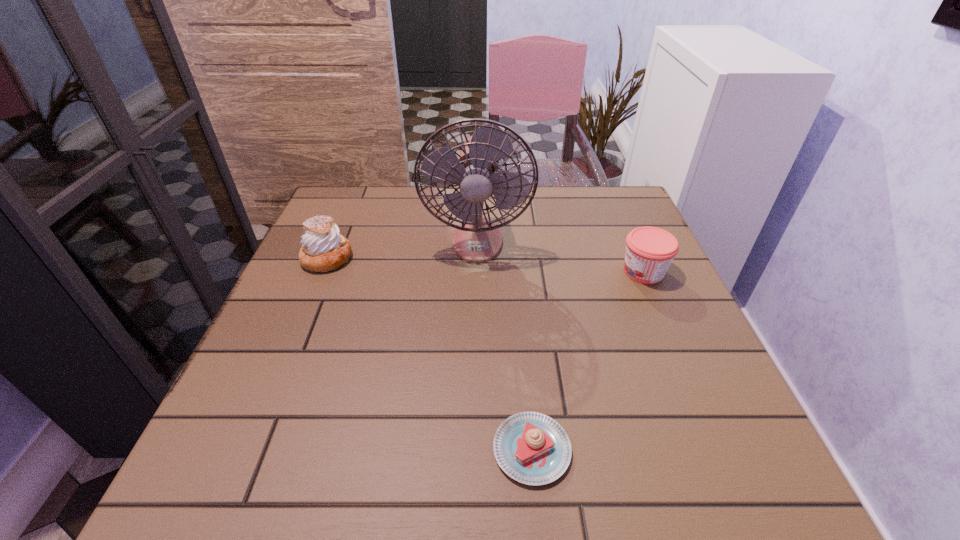
Find the location of a particular element. Image resolution: width=960 pixels, height=540 pixels. vacant space situated on the front label of the second shortest object is located at coordinates pos(508,272).

Image resolution: width=960 pixels, height=540 pixels. In order to click on vacant space situated 0.110m on the front label of the second shortest object in this screenshot , I will do `click(570, 272)`.

At what (x,y) coordinates should I click in order to perform the action: click on vacant space located on the back of the right pastry. Please return your answer as a coordinate pair (x, y). Looking at the image, I should click on (519, 318).

You are a GUI agent. You are given a task and a screenshot of the screen. Output one action in this format:
    pyautogui.click(x=<x>, y=<y>)
    Task: Click on the object that is at the far edge
    
    Given the screenshot: What is the action you would take?
    pyautogui.click(x=477, y=239)

Image resolution: width=960 pixels, height=540 pixels. In order to click on object that is positioned at the near edge in this screenshot , I will do `click(532, 448)`.

The height and width of the screenshot is (540, 960). Identify the location of object situated at the left edge. (324, 249).

The height and width of the screenshot is (540, 960). I want to click on object that is positioned at the right edge, so click(x=650, y=251).

In the image, there is a desktop. Identify the location of vacant area at the far edge. (389, 214).

In the image, there is a desktop. Where is `vacant space at the near edge`? Image resolution: width=960 pixels, height=540 pixels. vacant space at the near edge is located at coordinates (332, 480).

You are a GUI agent. You are given a task and a screenshot of the screen. Output one action in this format:
    pyautogui.click(x=<x>, y=<y>)
    Task: Click on the free space at the left edge of the desktop
    This screenshot has height=540, width=960.
    Given the screenshot: What is the action you would take?
    pyautogui.click(x=259, y=417)